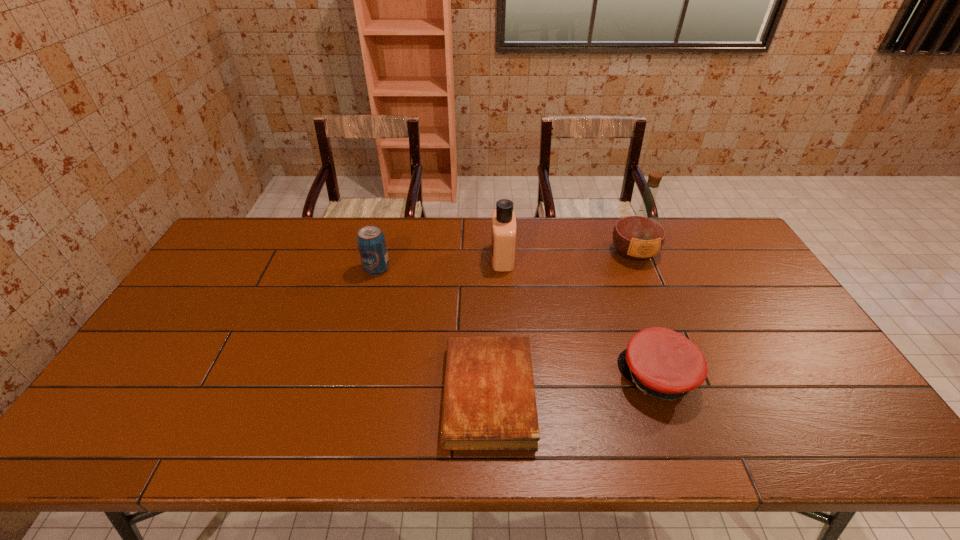
The image size is (960, 540). Find the location of `vacant space at the far edge of the desktop`. vacant space at the far edge of the desktop is located at coordinates (408, 244).

You are a GUI agent. You are given a task and a screenshot of the screen. Output one action in this format:
    pyautogui.click(x=<x>, y=<y>)
    Task: Click on the free space at the left edge of the desktop
    
    Given the screenshot: What is the action you would take?
    pyautogui.click(x=237, y=259)

This screenshot has width=960, height=540. Find the location of `vacant space at the right edge`. vacant space at the right edge is located at coordinates (790, 341).

The image size is (960, 540). What are the coordinates of `vacant position at the far right corner of the desktop` in the screenshot? It's located at (744, 256).

The width and height of the screenshot is (960, 540). What are the coordinates of `free spot between the second tallest object and the cap` in the screenshot? It's located at (580, 317).

Where is `vacant region between the tallest object and the Bible`? The width and height of the screenshot is (960, 540). vacant region between the tallest object and the Bible is located at coordinates (562, 323).

This screenshot has width=960, height=540. I want to click on unoccupied position between the leftmost object and the fourth tallest object, so click(x=517, y=323).

The image size is (960, 540). In order to click on empty space that is in between the tallest object and the Bible in this screenshot , I will do `click(562, 323)`.

This screenshot has width=960, height=540. In order to click on unoccupied position between the tallest object and the second shortest object in this screenshot , I will do `click(646, 314)`.

Locate an element on the screen. The image size is (960, 540). free space between the liquor and the shortest object is located at coordinates (562, 323).